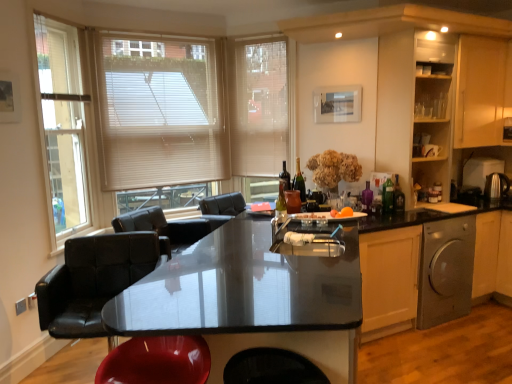
Question: Looking at the image, does shiny dark glass wine bottle at center seem bigger or smaller compared to beige fabric blind at upper center?

Choices:
 (A) big
 (B) small

Answer: (B)

Question: Would you say shiny dark glass wine bottle at center is to the left or to the right of beige fabric blind at upper center in the picture?

Choices:
 (A) right
 (B) left

Answer: (A)

Question: Which is nearer to the black leather chair at lower left?

Choices:
 (A) satin silver dishwasher at lower right
 (B) polished stainless steel kettle at right, positioned as the second appliance in back-to-front order
 (C) wooden cabinet at upper right, the 2th cabinetry from the left
 (D) polished stainless steel kettle at right, marked as the first appliance in a back-to-front arrangement
 (E) beige blinds at upper left

Answer: (E)

Question: Estimate the real-world distances between objects in this image. Which object is closer to the translucent glass bottle at center, arranged as the second bottle when viewed from the front?

Choices:
 (A) black leather chair at lower left
 (B) matte wooden cabinet at right, which is the 2th cabinetry in right-to-left order
 (C) wooden cabinet at upper right, the 2th cabinetry from the left
 (D) shiny dark glass wine bottle at center
 (E) orange matte fruit at center

Answer: (E)